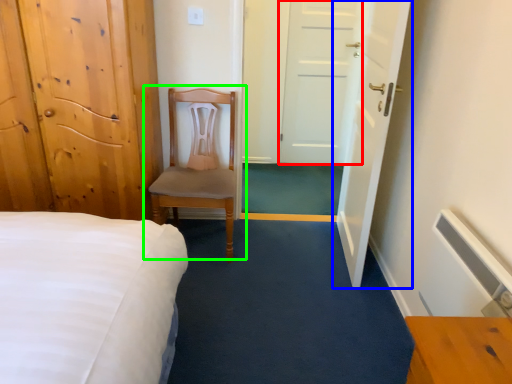
Question: Considering the real-world distances, which object is closest to door (highlighted by a red box)? door (highlighted by a blue box) or chair (highlighted by a green box).

Choices:
 (A) door
 (B) chair

Answer: (A)